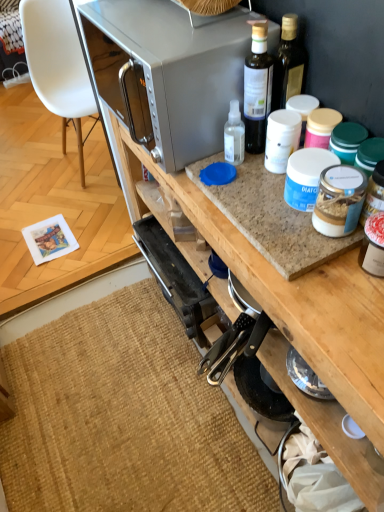
Question: From the image's perspective, does satin silver microwave at upper center appear lower than translucent plastic bottle at upper center?

Choices:
 (A) yes
 (B) no

Answer: (B)

Question: Considering the relative positions of satin silver microwave at upper center and translucent plastic bottle at upper center in the image provided, is satin silver microwave at upper center behind translucent plastic bottle at upper center?

Choices:
 (A) yes
 (B) no

Answer: (A)

Question: Can you confirm if satin silver microwave at upper center is positioned to the right of translucent plastic bottle at upper center?

Choices:
 (A) no
 (B) yes

Answer: (A)

Question: Can you confirm if satin silver microwave at upper center is smaller than translucent plastic bottle at upper center?

Choices:
 (A) no
 (B) yes

Answer: (A)

Question: Is satin silver microwave at upper center outside of translucent plastic bottle at upper center?

Choices:
 (A) no
 (B) yes

Answer: (B)

Question: Can you confirm if satin silver microwave at upper center is bigger than translucent plastic bottle at upper center?

Choices:
 (A) yes
 (B) no

Answer: (A)

Question: Considering the relative sizes of translucent plastic bottle at upper center and burlap mat at lower left in the image provided, is translucent plastic bottle at upper center wider than burlap mat at lower left?

Choices:
 (A) no
 (B) yes

Answer: (A)

Question: Is the surface of translucent plastic bottle at upper center in direct contact with burlap mat at lower left?

Choices:
 (A) yes
 (B) no

Answer: (B)

Question: Does translucent plastic bottle at upper center appear on the left side of burlap mat at lower left?

Choices:
 (A) yes
 (B) no

Answer: (B)

Question: Can you confirm if translucent plastic bottle at upper center is shorter than burlap mat at lower left?

Choices:
 (A) yes
 (B) no

Answer: (B)

Question: Is burlap mat at lower left inside translucent plastic bottle at upper center?

Choices:
 (A) no
 (B) yes

Answer: (A)

Question: Is burlap mat at lower left at the back of translucent plastic bottle at upper center?

Choices:
 (A) yes
 (B) no

Answer: (B)

Question: Is translucent plastic bottle at upper center at the back of burlap mat at lower left?

Choices:
 (A) no
 (B) yes

Answer: (A)